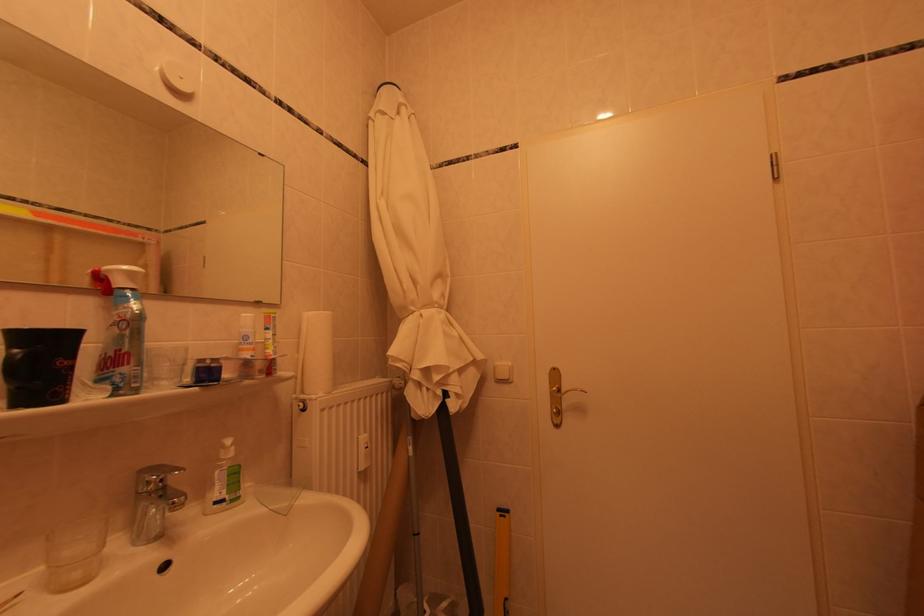
This screenshot has height=616, width=924. What are the coordinates of `soap dispenser pump` in the screenshot? It's located at (120, 330).